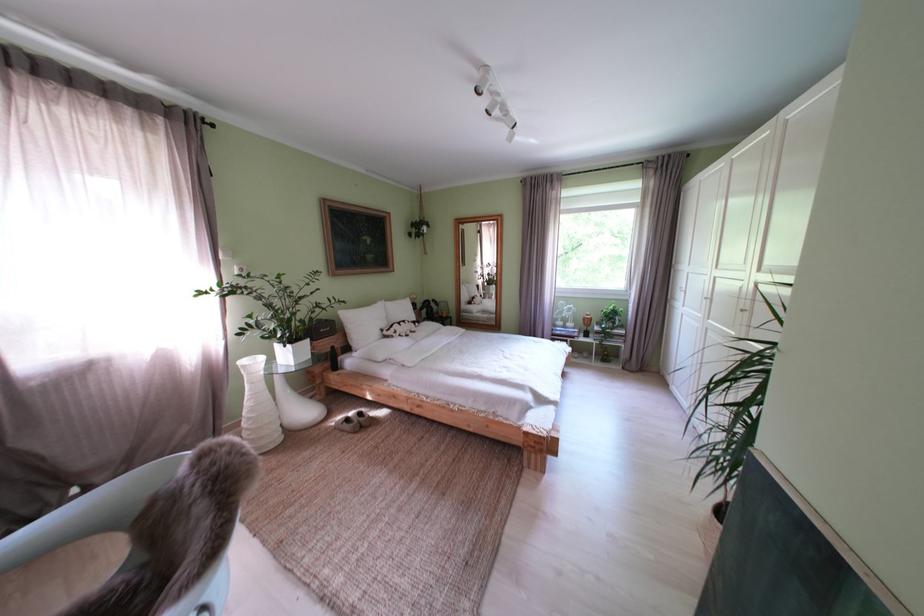
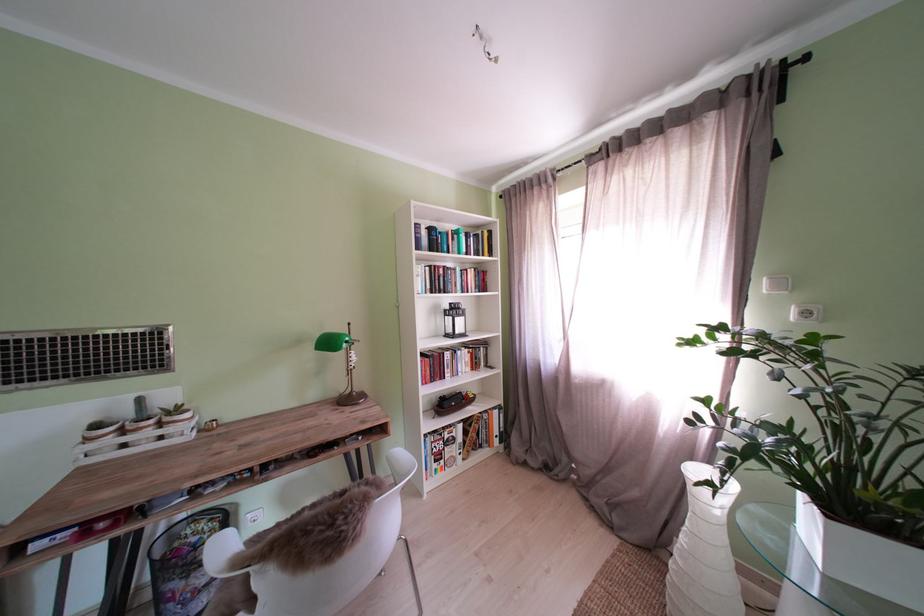
The point at [126,90] is marked in the first image. Where is the corresponding point in the second image?

(681, 116)